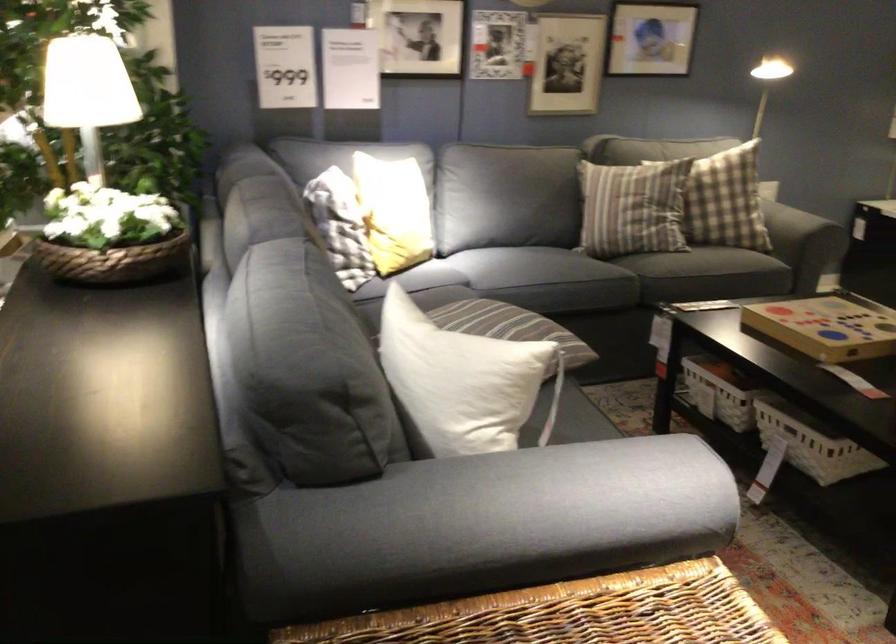
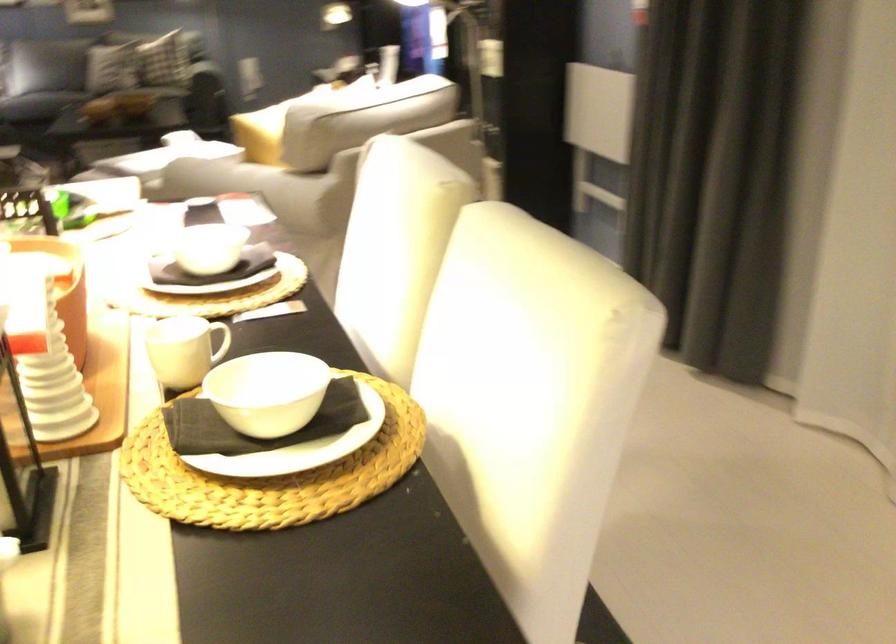
Question: I am providing you with two images of the same scene from different viewpoints. Which of the following objects are not visible in image2?

Choices:
 (A) white desk drawer
 (B) white plate
 (C) white bowl
 (D) wooden game box

Answer: (D)